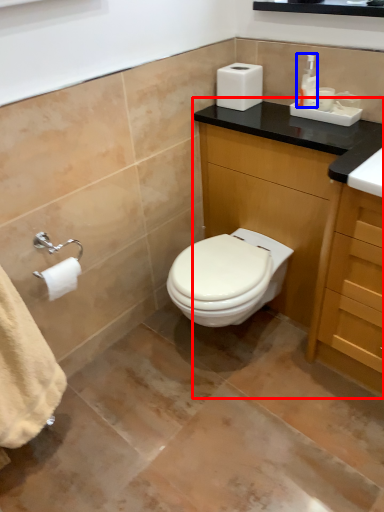
Question: Which object appears closest to the camera in this image, bathroom cabinet (highlighted by a red box) or toiletry (highlighted by a blue box)?

Choices:
 (A) bathroom cabinet
 (B) toiletry

Answer: (A)